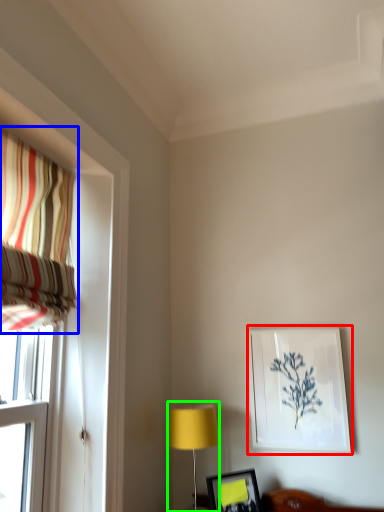
Question: Estimate the real-world distances between objects in this image. Which object is closer to picture frame (highlighted by a red box), curtain (highlighted by a blue box) or table lamp (highlighted by a green box)?

Choices:
 (A) curtain
 (B) table lamp

Answer: (B)